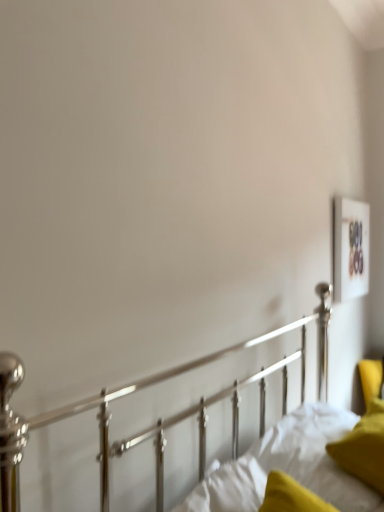
Looking at this image, measure the distance between point (344, 275) and camera.

Point (344, 275) is 2.55 meters away from camera.

What is the approximate width of velvet yellow pillow at lower right?

It is 8.55 inches.

Locate an element on the screen. white soft mattress at lower right is located at coordinates (x=287, y=466).

Does velvet yellow pillow at lower right appear on the right side of wooden frame at upper right?

In fact, velvet yellow pillow at lower right is to the left of wooden frame at upper right.

Can you confirm if velvet yellow pillow at lower right is smaller than wooden frame at upper right?

Incorrect, velvet yellow pillow at lower right is not smaller in size than wooden frame at upper right.

From the picture: Is velvet yellow pillow at lower right facing towards wooden frame at upper right?

No, velvet yellow pillow at lower right is not oriented towards wooden frame at upper right.

Is wooden frame at upper right oriented away from white soft mattress at lower right?

No, wooden frame at upper right is not facing away from white soft mattress at lower right.

Between wooden frame at upper right and white soft mattress at lower right, which one appears on the right side from the viewer's perspective?

From the viewer's perspective, wooden frame at upper right appears more on the right side.

From a real-world perspective, is wooden frame at upper right beneath white soft mattress at lower right?

No.

Which of these two, white soft mattress at lower right or velvet yellow pillow at lower right, is bigger?

white soft mattress at lower right.

Is white soft mattress at lower right far away from velvet yellow pillow at lower right?

No.

Considering the relative sizes of white soft mattress at lower right and velvet yellow pillow at lower right in the image provided, is white soft mattress at lower right wider than velvet yellow pillow at lower right?

Yes.

From a real-world perspective, who is located higher, white soft mattress at lower right or velvet yellow pillow at lower right?

From a 3D spatial view, velvet yellow pillow at lower right is above.

Is there a large distance between white soft mattress at lower right and wooden frame at upper right?

Yes, white soft mattress at lower right and wooden frame at upper right are quite far apart.

Is white soft mattress at lower right wider than wooden frame at upper right?

Yes.

From the image's perspective, which is above, white soft mattress at lower right or wooden frame at upper right?

wooden frame at upper right, from the image's perspective.

From the image's perspective, which object appears higher, velvet yellow pillow at lower right or white soft mattress at lower right?

velvet yellow pillow at lower right is shown above in the image.

Is velvet yellow pillow at lower right not within white soft mattress at lower right?

No, velvet yellow pillow at lower right is inside white soft mattress at lower right's boundary.

Is velvet yellow pillow at lower right not near white soft mattress at lower right?

Actually, velvet yellow pillow at lower right and white soft mattress at lower right are a little close together.

From the picture: Between velvet yellow pillow at lower right and white soft mattress at lower right, which one has smaller width?

velvet yellow pillow at lower right is thinner.

Measure the distance from wooden frame at upper right to velvet yellow pillow at lower right.

wooden frame at upper right and velvet yellow pillow at lower right are 3.60 feet apart from each other.

Considering the positions of objects wooden frame at upper right and velvet yellow pillow at lower right in the image provided, who is in front, wooden frame at upper right or velvet yellow pillow at lower right?

Positioned in front is velvet yellow pillow at lower right.

Is wooden frame at upper right far away from velvet yellow pillow at lower right?

wooden frame at upper right is far away from velvet yellow pillow at lower right.

Where is `picture frame behind the velvet yellow pillow at lower right`? This screenshot has width=384, height=512. picture frame behind the velvet yellow pillow at lower right is located at coordinates (350, 249).

At what (x,y) coordinates should I click in order to perform the action: click on picture frame above the white soft mattress at lower right (from a real-world perspective). Please return your answer as a coordinate pair (x, y). Looking at the image, I should click on (350, 249).

When comparing their distances from velvet yellow pillow at lower right, does white soft mattress at lower right or wooden frame at upper right seem further?

wooden frame at upper right lies further to velvet yellow pillow at lower right than the other object.

Estimate the real-world distances between objects in this image. Which object is closer to wooden frame at upper right, white soft mattress at lower right or velvet yellow pillow at lower right?

Based on the image, velvet yellow pillow at lower right appears to be nearer to wooden frame at upper right.

Estimate the real-world distances between objects in this image. Which object is closer to velvet yellow pillow at lower right, wooden frame at upper right or white soft mattress at lower right?

Based on the image, white soft mattress at lower right appears to be nearer to velvet yellow pillow at lower right.

Which object lies nearer to the anchor point white soft mattress at lower right, wooden frame at upper right or velvet yellow pillow at lower right?

velvet yellow pillow at lower right lies closer to white soft mattress at lower right than the other object.

Based on their spatial positions, is velvet yellow pillow at lower right or wooden frame at upper right closer to white soft mattress at lower right?

velvet yellow pillow at lower right.

Estimate the real-world distances between objects in this image. Which object is further from wooden frame at upper right, velvet yellow pillow at lower right or white soft mattress at lower right?

white soft mattress at lower right is further to wooden frame at upper right.

This screenshot has height=512, width=384. In order to click on pillow between white soft mattress at lower right and wooden frame at upper right along the z-axis in this screenshot , I will do `click(364, 447)`.